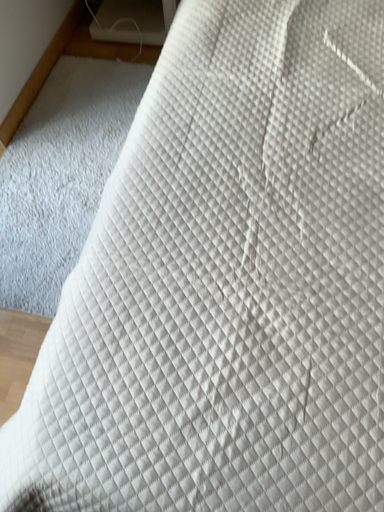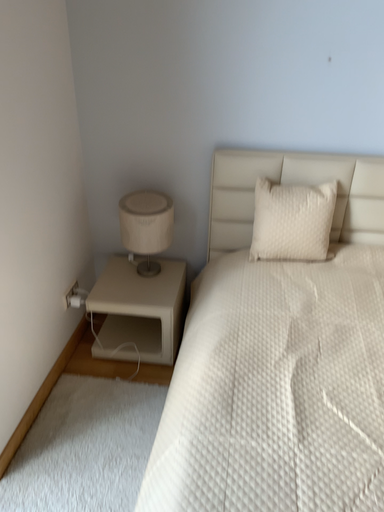
Question: How did the camera likely rotate when shooting the video?

Choices:
 (A) rotated right
 (B) rotated left

Answer: (A)